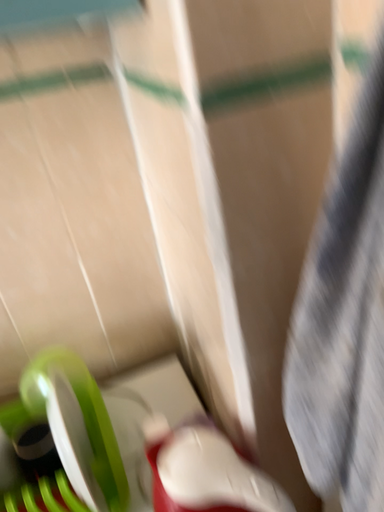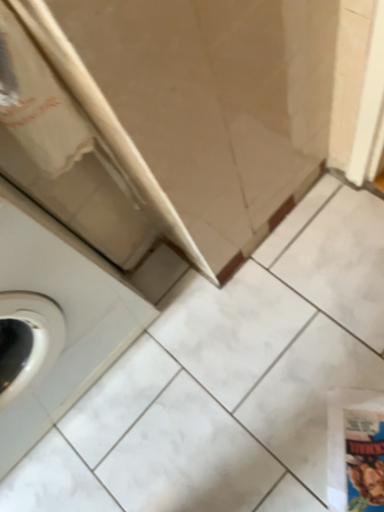
Question: Which way did the camera rotate in the video?

Choices:
 (A) rotated left
 (B) rotated right

Answer: (B)